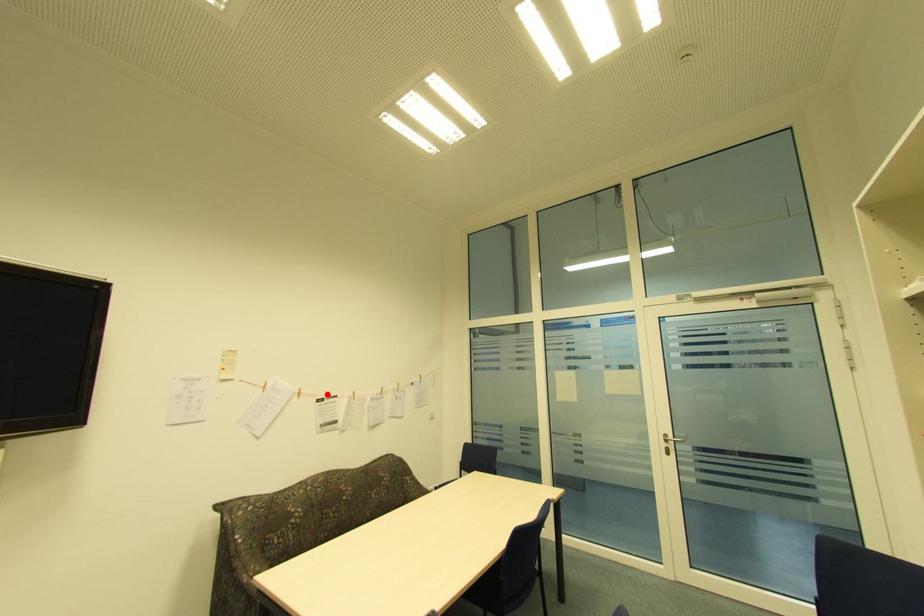
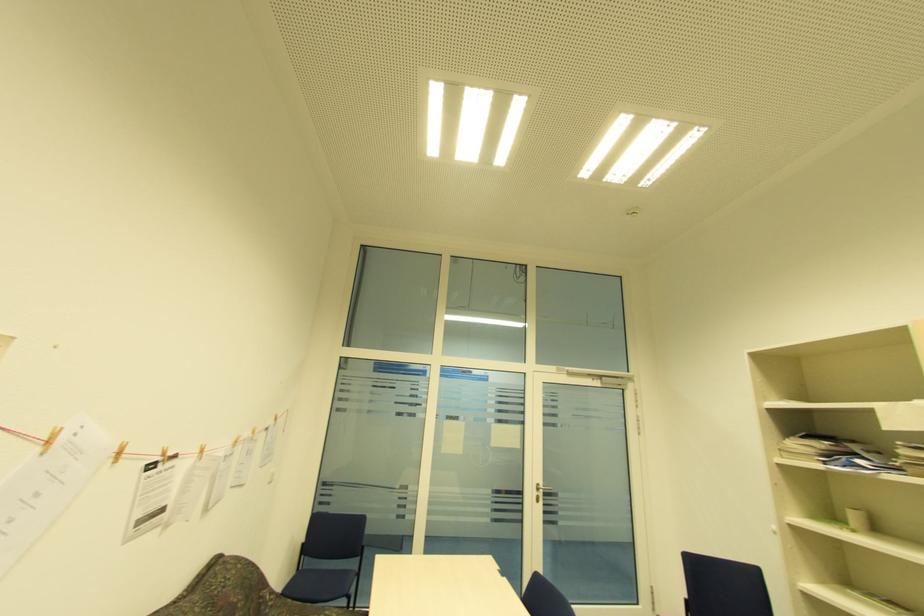
The point at the highlighted location is marked in the first image. Where is the corresponding point in the second image?

(163, 454)